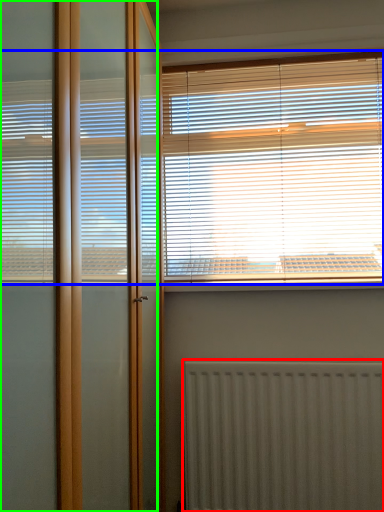
Question: Estimate the real-world distances between objects in this image. Which object is farther from radiator (highlighted by a red box), window blind (highlighted by a blue box) or screen door (highlighted by a green box)?

Choices:
 (A) window blind
 (B) screen door

Answer: (B)